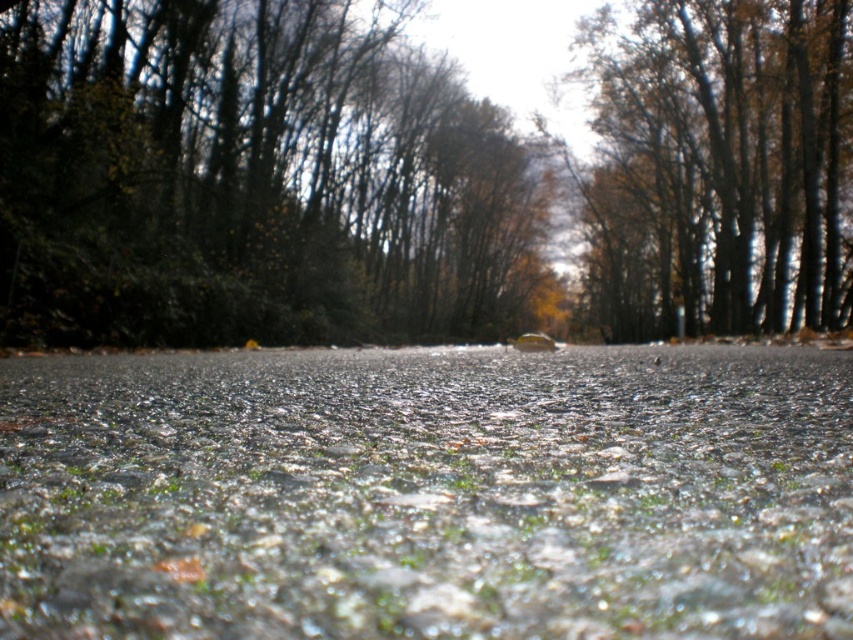
Question: Among these objects, which one is farthest from the camera?

Choices:
 (A) brown wood tree at upper right
 (B) dark green leafy tree at center

Answer: (A)

Question: Does dark green leafy tree at center appear under brown wood tree at upper right?

Choices:
 (A) no
 (B) yes

Answer: (B)

Question: Where is dark green leafy tree at center located in relation to brown wood tree at upper right in the image?

Choices:
 (A) above
 (B) below

Answer: (B)

Question: Where is dark green leafy tree at center located in relation to brown wood tree at upper right in the image?

Choices:
 (A) below
 (B) above

Answer: (A)